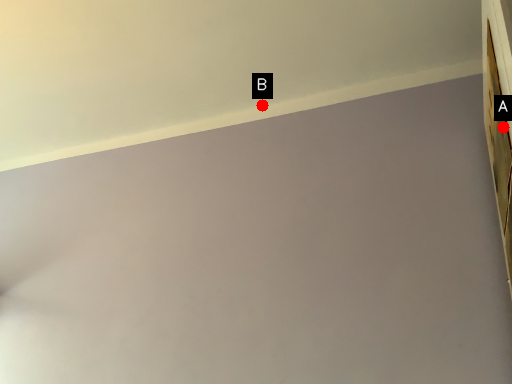
Question: Two points are circled on the image, labeled by A and B beside each circle. Among these points, which one is nearest to the camera?

Choices:
 (A) A is closer
 (B) B is closer

Answer: (A)